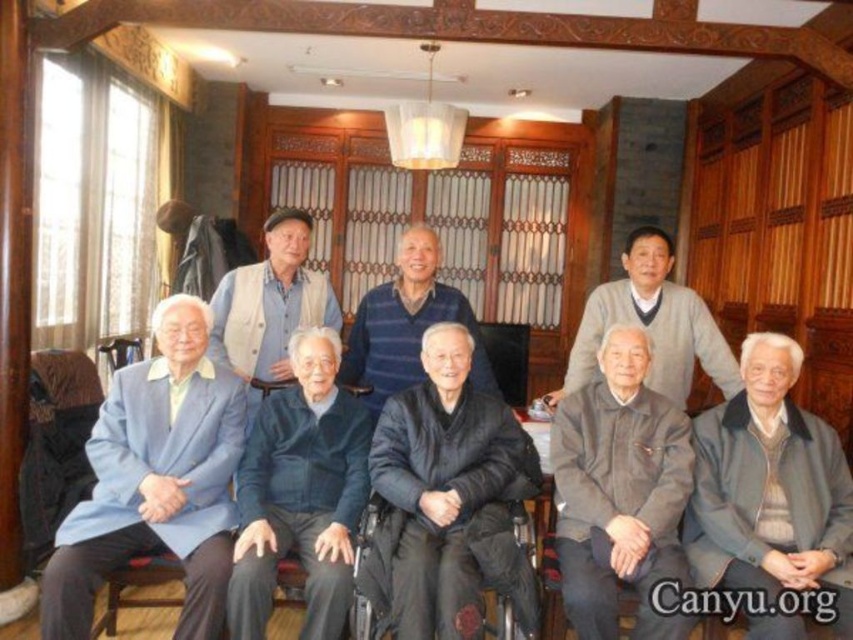
Question: Is dark gray fabric at center positioned at the back of gray fabric jacket at lower right?

Choices:
 (A) yes
 (B) no

Answer: (B)

Question: Which object appears farthest from the camera in this image?

Choices:
 (A) gray fabric jacket at lower right
 (B) dark blue sweater at center
 (C) dark gray fabric at center

Answer: (B)

Question: Can you confirm if gray fabric jacket at lower right is smaller than dark gray fabric jacket at lower center?

Choices:
 (A) yes
 (B) no

Answer: (B)

Question: Which object is closer to the camera taking this photo?

Choices:
 (A) dark blue fabric jacket at lower center
 (B) dark gray fabric jacket at lower center

Answer: (B)

Question: Among these points, which one is farthest from the camera?

Choices:
 (A) (618, 289)
 (B) (248, 476)
 (C) (631, 420)
 (D) (439, 493)

Answer: (A)

Question: Where is gray fabric jacket at lower right located in relation to dark blue sweater at center in the image?

Choices:
 (A) right
 (B) left

Answer: (A)